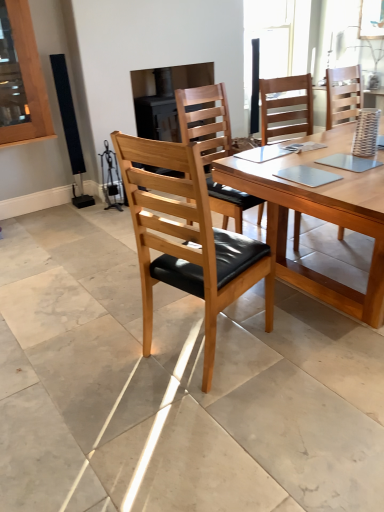
Question: Is light brown wood chair at center, the 1th chair in the right-to-left sequence, directly adjacent to transparent glass window at upper center?

Choices:
 (A) no
 (B) yes

Answer: (A)

Question: Is light brown wood chair at center, the 1th chair in the right-to-left sequence, to the left of transparent glass window at upper center from the viewer's perspective?

Choices:
 (A) yes
 (B) no

Answer: (A)

Question: Can you confirm if light brown wood chair at center, marked as the third chair in a left-to-right arrangement, is smaller than transparent glass window at upper center?

Choices:
 (A) yes
 (B) no

Answer: (B)

Question: Considering the relative sizes of light brown wood chair at center, marked as the third chair in a left-to-right arrangement, and transparent glass window at upper center in the image provided, is light brown wood chair at center, marked as the third chair in a left-to-right arrangement, bigger than transparent glass window at upper center?

Choices:
 (A) yes
 (B) no

Answer: (A)

Question: Does light brown wood chair at center, the 1th chair in the right-to-left sequence, have a greater height compared to transparent glass window at upper center?

Choices:
 (A) no
 (B) yes

Answer: (B)

Question: Is light brown wood chair at center, the 1th chair in the right-to-left sequence, positioned with its back to transparent glass window at upper center?

Choices:
 (A) no
 (B) yes

Answer: (A)

Question: From a real-world perspective, is wooden table at center physically above natural wood/black leather chair at center, the first chair from the left?

Choices:
 (A) yes
 (B) no

Answer: (B)

Question: From the image's perspective, is wooden table at center over natural wood/black leather chair at center, the third chair in the right-to-left sequence?

Choices:
 (A) no
 (B) yes

Answer: (B)

Question: From a real-world perspective, is wooden table at center positioned under natural wood/black leather chair at center, the first chair from the left, based on gravity?

Choices:
 (A) yes
 (B) no

Answer: (A)

Question: Is wooden table at center not inside natural wood/black leather chair at center, the third chair in the right-to-left sequence?

Choices:
 (A) no
 (B) yes

Answer: (B)

Question: Is wooden table at center closer to the viewer compared to natural wood/black leather chair at center, the first chair from the left?

Choices:
 (A) yes
 (B) no

Answer: (B)

Question: Is the surface of wooden table at center in direct contact with natural wood/black leather chair at center, the first chair from the left?

Choices:
 (A) yes
 (B) no

Answer: (B)

Question: Does light brown wood chair at center, the 1th chair in the right-to-left sequence, lie behind natural wood/black leather chair at center, the third chair in the right-to-left sequence?

Choices:
 (A) no
 (B) yes

Answer: (B)